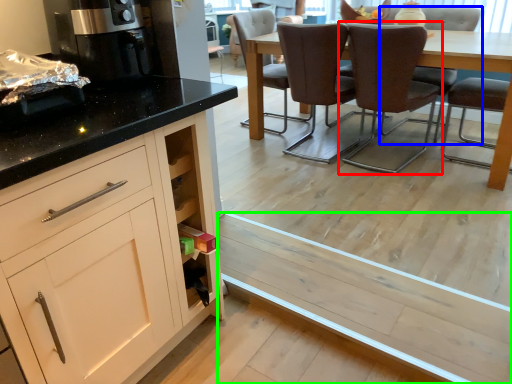
Question: Which object is positioned farthest from chair (highlighted by a red box)? Select from chair (highlighted by a blue box) and plank (highlighted by a green box).

Choices:
 (A) chair
 (B) plank

Answer: (B)